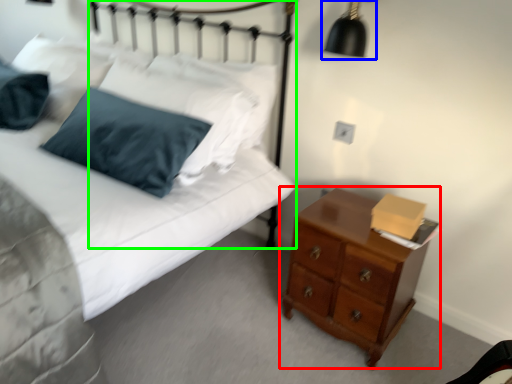
Question: Which object is the closest to the chest of drawers (highlighted by a red box)? Choose among these: lamp (highlighted by a blue box) or headboard (highlighted by a green box).

Choices:
 (A) lamp
 (B) headboard

Answer: (A)